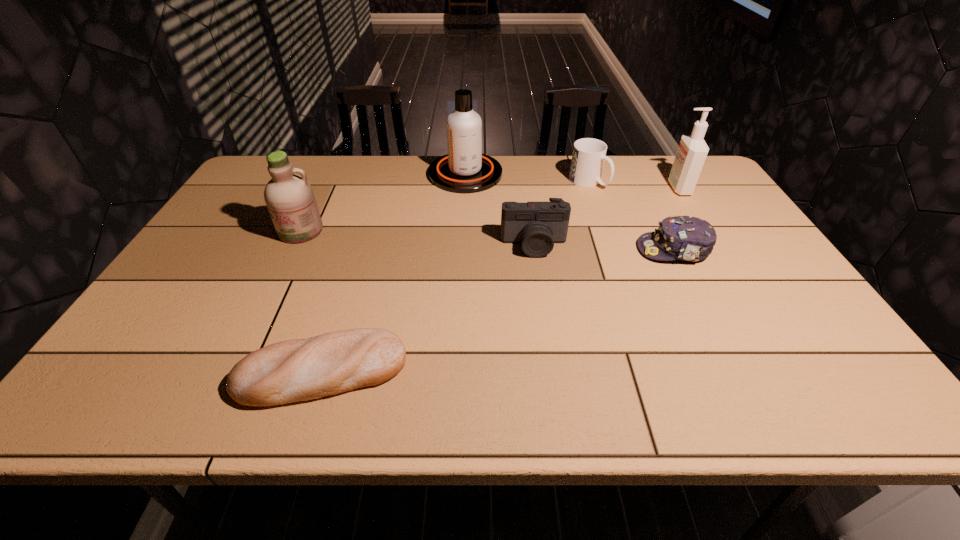
Identify the location of free location located 0.150m on the front label of the rightmost cleansing agent. This screenshot has height=540, width=960. (622, 188).

Identify the location of blank area located 0.240m on the front label of the leftmost cleansing agent. Image resolution: width=960 pixels, height=540 pixels. (263, 307).

You are a GUI agent. You are given a task and a screenshot of the screen. Output one action in this format:
    pyautogui.click(x=<x>, y=<y>)
    Task: Click on the free space located 0.220m on the right of the mug
    This screenshot has width=960, height=540.
    Given the screenshot: What is the action you would take?
    pyautogui.click(x=672, y=182)

Locate an element on the screen. The height and width of the screenshot is (540, 960). vacant space situated 0.200m at the lens of the camera is located at coordinates (543, 314).

Locate an element on the screen. The height and width of the screenshot is (540, 960). vacant space located on the front-facing side of the headwear is located at coordinates (495, 249).

Where is `free space located 0.170m on the front-facing side of the headwear`? free space located 0.170m on the front-facing side of the headwear is located at coordinates (576, 249).

Identify the location of vacant region located on the front-facing side of the headwear. (568, 249).

You are a GUI agent. You are given a task and a screenshot of the screen. Output one action in this format:
    pyautogui.click(x=<x>, y=<y>)
    Task: Click on the vacant space situated on the right of the nearest object
    The image size is (960, 540).
    Given the screenshot: What is the action you would take?
    pyautogui.click(x=483, y=372)

At what (x,y) coordinates should I click in order to perform the action: click on mug that is positioned at the far edge. Please return your answer as a coordinate pair (x, y). This screenshot has height=540, width=960. Looking at the image, I should click on (589, 154).

Find the location of a particular element. object that is positioned at the near edge is located at coordinates (295, 370).